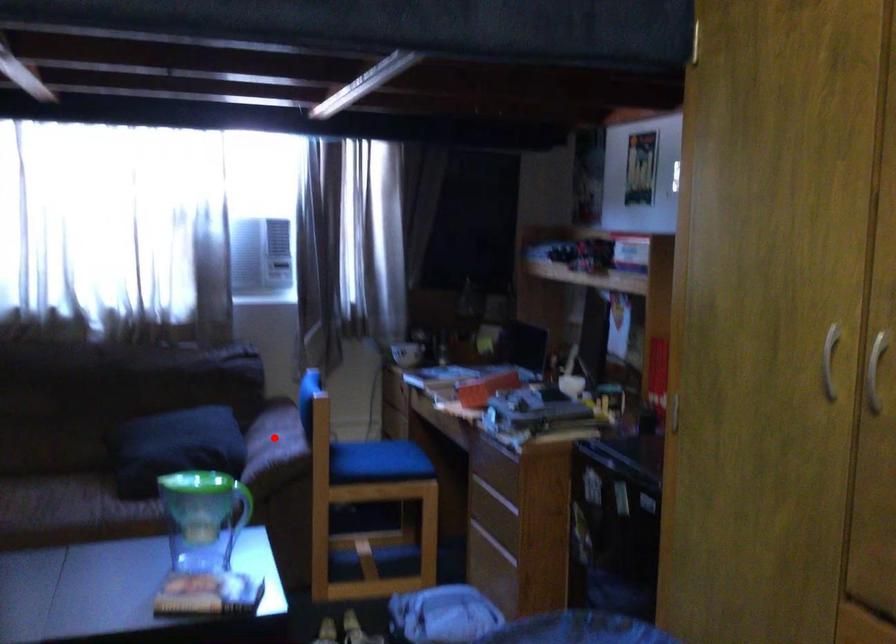
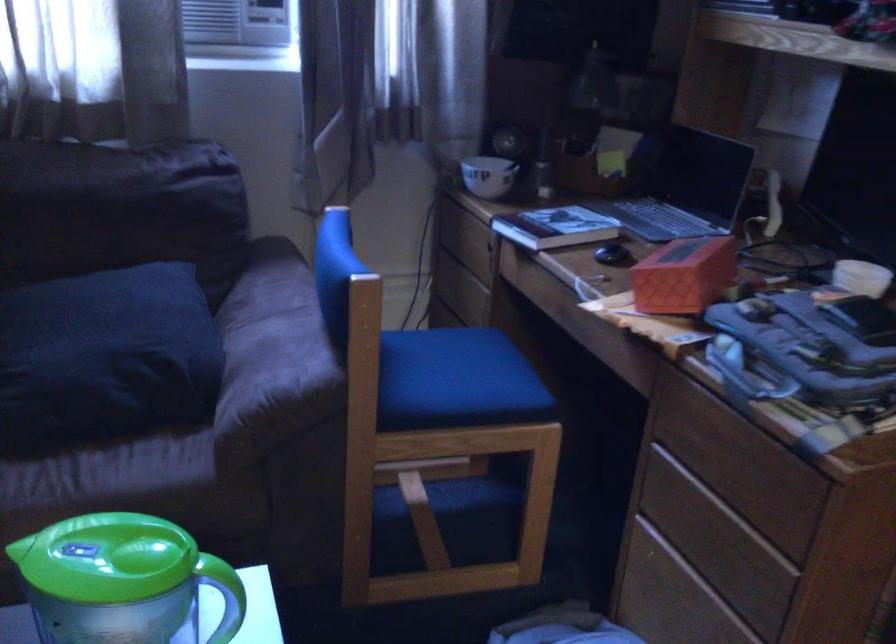
Question: A red point is marked in image1. In image2, is the corresponding 3D point closer to the camera or farther? Reply with the corresponding letter.

Choices:
 (A) The corresponding 3D point is closer.
 (B) The corresponding 3D point is farther.

Answer: (A)